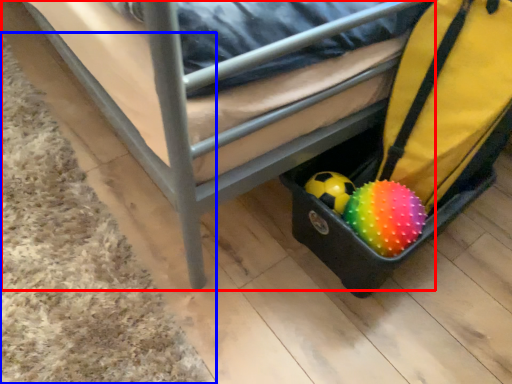
Question: Among these objects, which one is nearest to the camera, furniture (highlighted by a red box) or mat (highlighted by a blue box)?

Choices:
 (A) furniture
 (B) mat

Answer: (A)